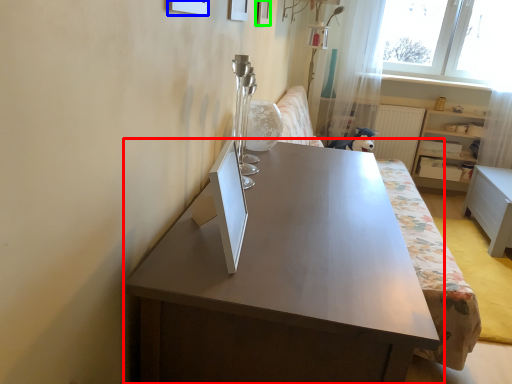
Question: Which is nearer to the table (highlighted by a red box)? picture frame (highlighted by a blue box) or picture frame (highlighted by a green box).

Choices:
 (A) picture frame
 (B) picture frame

Answer: (A)